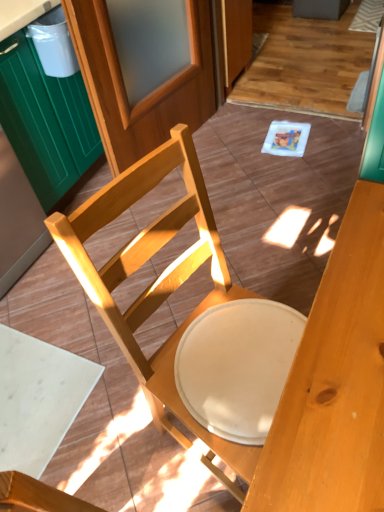
Question: Considering the positions of point (79, 42) and point (43, 69), is point (79, 42) closer or farther from the camera than point (43, 69)?

Choices:
 (A) closer
 (B) farther

Answer: (A)

Question: Looking at their shapes, would you say wooden screen door at upper center is wider or thinner than white plastic trash bin at upper left?

Choices:
 (A) wide
 (B) thin

Answer: (A)

Question: Estimate the real-world distances between objects in this image. Which object is closer to the green wood cabinet at left?

Choices:
 (A) wooden chair at center
 (B) white plastic trash bin at upper left
 (C) wooden screen door at upper center

Answer: (B)

Question: Which is nearer to the white plastic trash bin at upper left?

Choices:
 (A) green wood cabinet at left
 (B) wooden screen door at upper center
 (C) wooden chair at center

Answer: (A)